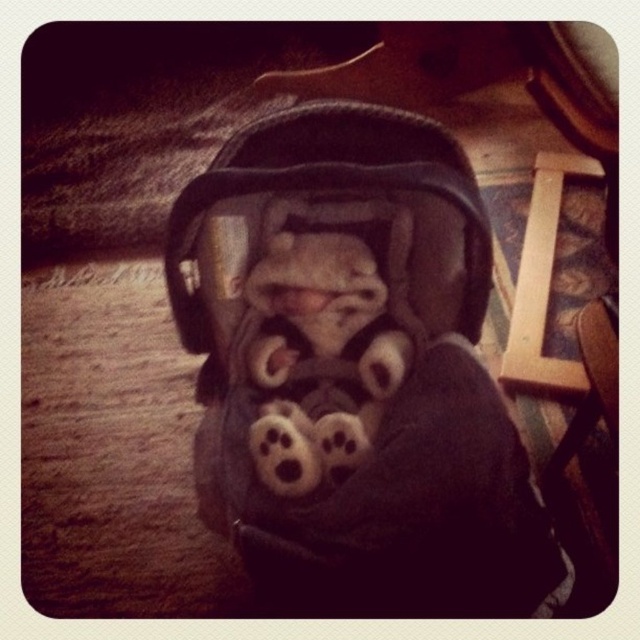
Question: Can you confirm if dark gray fabric baby carriage at center is positioned to the right of white plush toy at center?

Choices:
 (A) yes
 (B) no

Answer: (A)

Question: Does dark gray fabric baby carriage at center have a smaller size compared to white plush toy at center?

Choices:
 (A) no
 (B) yes

Answer: (A)

Question: Among these objects, which one is farthest from the camera?

Choices:
 (A) white plush toy at center
 (B) dark gray fabric baby carriage at center

Answer: (A)

Question: Does dark gray fabric baby carriage at center appear on the left side of white plush toy at center?

Choices:
 (A) yes
 (B) no

Answer: (B)